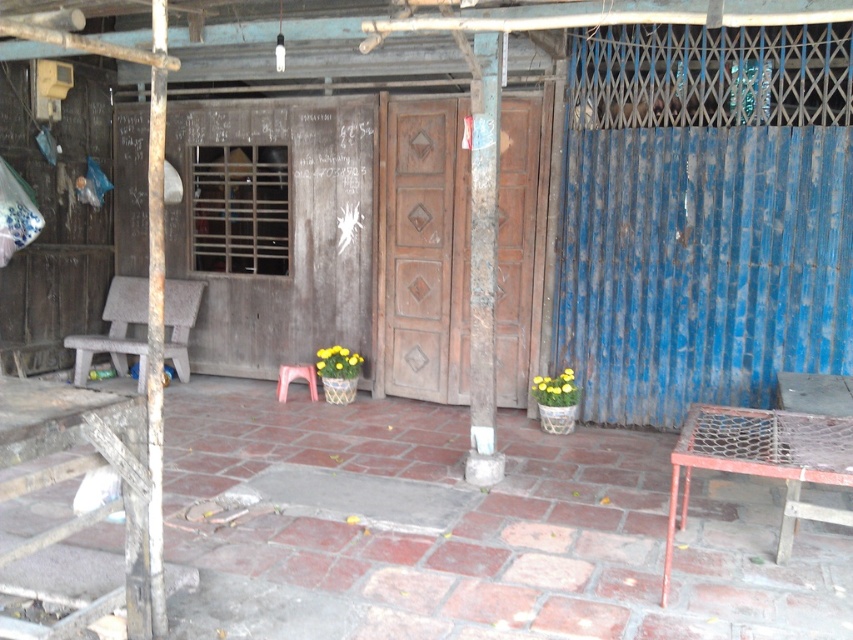
You are standing at the entrance of the shop and need to locate the wooden door at center and the plastic stool at lower center. Based on their positions, which object is closer to your right side?

The wooden door at center is to the right of the plastic stool at lower center, so the wooden door at center is closer to your right side.